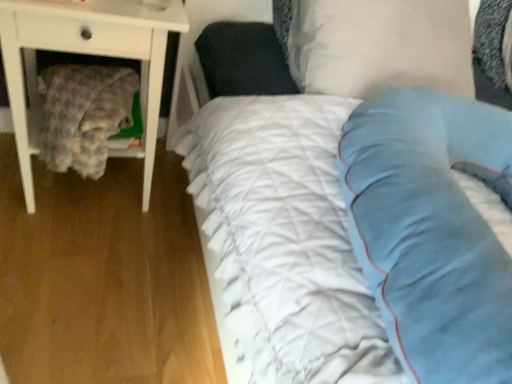
Question: From a real-world perspective, is white wood nightstand at left positioned above or below fluffy fabric blanket at left?

Choices:
 (A) above
 (B) below

Answer: (B)

Question: Which is correct: white wood nightstand at left is inside fluffy fabric blanket at left, or outside of it?

Choices:
 (A) outside
 (B) inside

Answer: (A)

Question: Considering the real-world distances, which object is farthest from the white soft pillow at upper center?

Choices:
 (A) white quilted fabric at center
 (B) white wood nightstand at left
 (C) fluffy fabric blanket at left

Answer: (C)

Question: Which is farther from the white wood nightstand at left?

Choices:
 (A) white quilted fabric at center
 (B) fluffy fabric blanket at left
 (C) white soft pillow at upper center

Answer: (C)